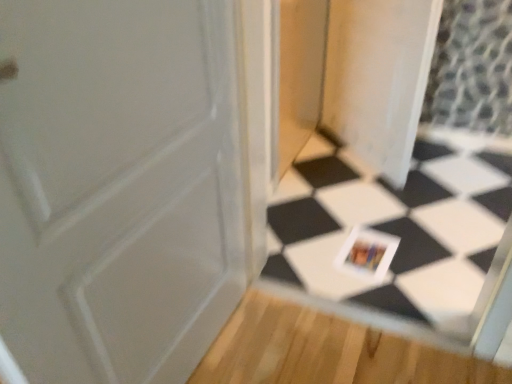
Question: Are white glossy postcard at center and transparent plastic screen door at center beside each other?

Choices:
 (A) yes
 (B) no

Answer: (B)

Question: Is white glossy postcard at center aimed at transparent plastic screen door at center?

Choices:
 (A) yes
 (B) no

Answer: (B)

Question: Is white glossy postcard at center positioned with its back to transparent plastic screen door at center?

Choices:
 (A) yes
 (B) no

Answer: (B)

Question: Is white glossy postcard at center located outside transparent plastic screen door at center?

Choices:
 (A) no
 (B) yes

Answer: (B)

Question: From the image's perspective, is white glossy postcard at center on top of transparent plastic screen door at center?

Choices:
 (A) no
 (B) yes

Answer: (A)

Question: Considering the relative sizes of white glossy postcard at center and transparent plastic screen door at center in the image provided, is white glossy postcard at center bigger than transparent plastic screen door at center?

Choices:
 (A) no
 (B) yes

Answer: (A)

Question: Can white glossy tile at center be found inside white glossy postcard at center?

Choices:
 (A) yes
 (B) no

Answer: (B)

Question: Is white glossy postcard at center completely or partially outside of white glossy tile at center?

Choices:
 (A) no
 (B) yes

Answer: (B)

Question: Is white glossy postcard at center thinner than white glossy tile at center?

Choices:
 (A) no
 (B) yes

Answer: (A)

Question: Is white glossy postcard at center positioned behind white glossy tile at center?

Choices:
 (A) yes
 (B) no

Answer: (A)

Question: From the image's perspective, is white glossy postcard at center under white glossy tile at center?

Choices:
 (A) no
 (B) yes

Answer: (B)

Question: Considering the relative positions of white glossy postcard at center and white glossy tile at center in the image provided, is white glossy postcard at center to the left of white glossy tile at center from the viewer's perspective?

Choices:
 (A) yes
 (B) no

Answer: (B)

Question: Is transparent plastic screen door at center closer to camera compared to white glossy tile at center?

Choices:
 (A) yes
 (B) no

Answer: (B)